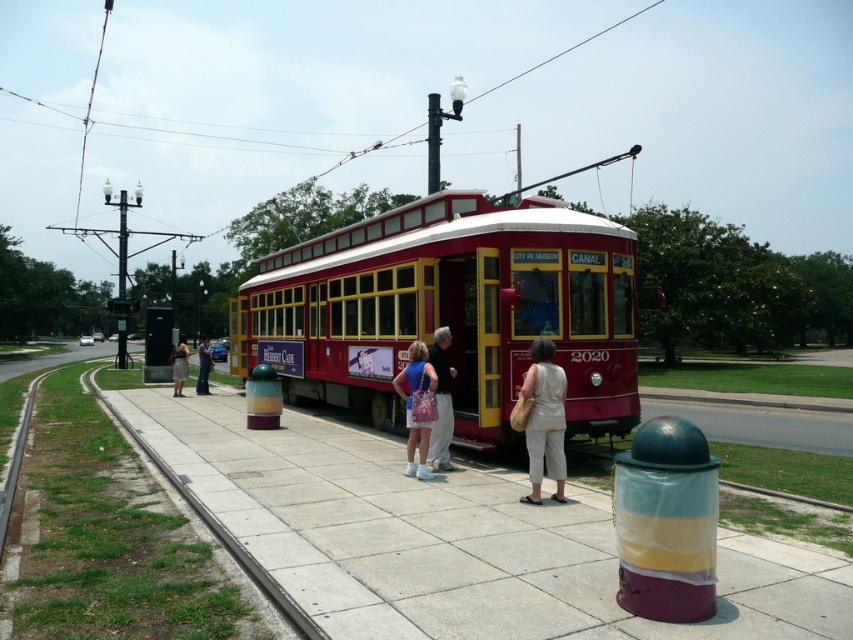
Question: Can you confirm if beige cotton pants at center is smaller than concrete curb at lower left?

Choices:
 (A) no
 (B) yes

Answer: (B)

Question: Does smooth concrete pavement at center have a larger size compared to denim shorts at center?

Choices:
 (A) no
 (B) yes

Answer: (B)

Question: Observing the image, what is the correct spatial positioning of shiny red trolley at center in reference to black plastic bus stop at lower left?

Choices:
 (A) right
 (B) left

Answer: (A)

Question: Which point is closer to the camera?

Choices:
 (A) (169, 346)
 (B) (450, 432)
 (C) (184, 376)

Answer: (B)

Question: Which object is positioned farthest from the shiny red trolley at center?

Choices:
 (A) black plastic bus stop at lower left
 (B) denim pants at center
 (C) denim skirt at left
 (D) light beige cotton dress at center

Answer: (A)

Question: Which point appears farthest from the camera in this image?

Choices:
 (A) (229, 540)
 (B) (180, 384)
 (C) (440, 444)

Answer: (B)